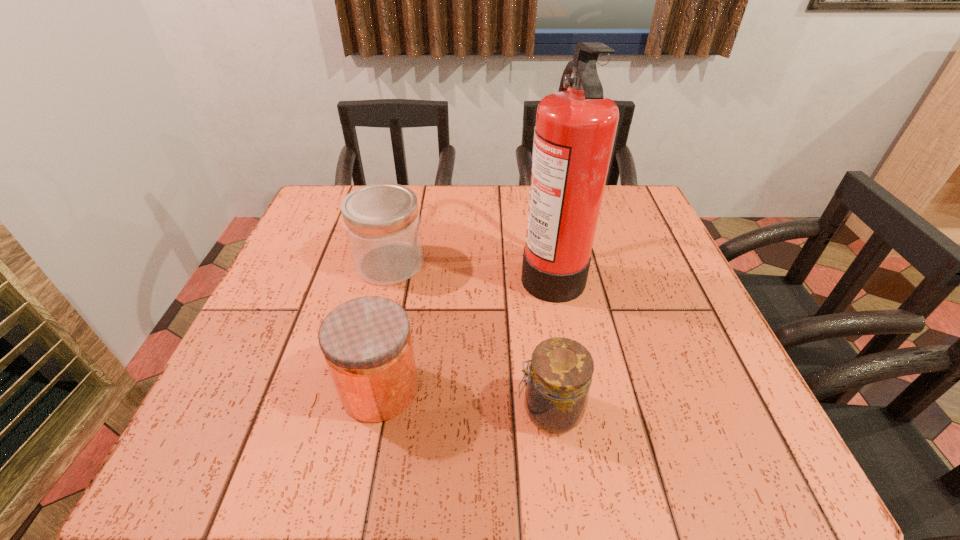
The image size is (960, 540). In order to click on empty space between the farthest jar and the tallest object in this screenshot , I will do `click(470, 267)`.

Locate which object is the closest to the tallest object. Please provide its 2D coordinates. Your answer should be formatted as a tuple, i.e. [(x, y)], where the tuple contains the x and y coordinates of a point satisfying the conditions above.

[(559, 377)]

Identify which object is the third nearest to the fire extinguisher. Please provide its 2D coordinates. Your answer should be formatted as a tuple, i.e. [(x, y)], where the tuple contains the x and y coordinates of a point satisfying the conditions above.

[(366, 342)]

Locate which jar ranks third in proximity to the tallest object. Please provide its 2D coordinates. Your answer should be formatted as a tuple, i.e. [(x, y)], where the tuple contains the x and y coordinates of a point satisfying the conditions above.

[(366, 342)]

This screenshot has height=540, width=960. Find the location of `the closest jar to the farthest jar`. the closest jar to the farthest jar is located at coordinates (366, 342).